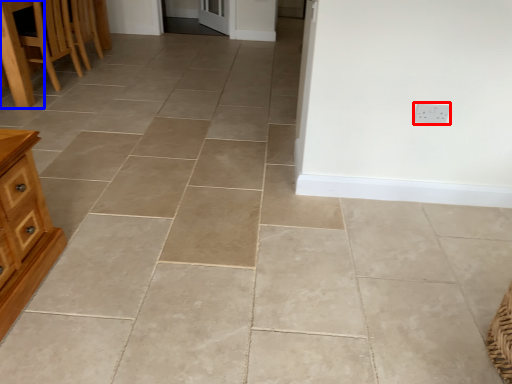
Question: Which of the following is the closest to the observer, electric outlet (highlighted by a red box) or table (highlighted by a blue box)?

Choices:
 (A) electric outlet
 (B) table

Answer: (A)